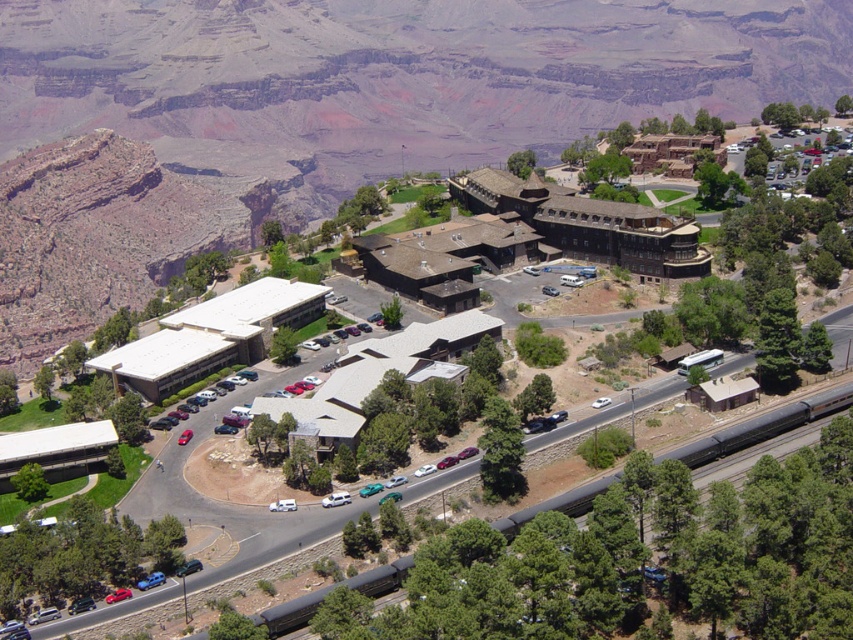
Is brown stone building at center taller than white glossy sedan at center-right?

Indeed, brown stone building at center has a greater height compared to white glossy sedan at center-right.

Who is more forward, (367,35) or (602,406)?

Positioned in front is point (602,406).

I want to click on brown stone building at center, so click(x=326, y=115).

From the picture: Which is below, dark gray metallic train track at lower center or white glossy sedan at center-right?

Positioned lower is dark gray metallic train track at lower center.

Does dark gray metallic train track at lower center have a smaller size compared to white glossy sedan at center-right?

No, dark gray metallic train track at lower center is not smaller than white glossy sedan at center-right.

Is point (547, 500) closer to viewer compared to point (598, 403)?

Yes, it is.

Find the location of a particular element. This screenshot has width=853, height=640. dark gray metallic train track at lower center is located at coordinates (761, 426).

Between dark gray metallic train track at lower center and blue matte car at lower left, which one is positioned higher?

dark gray metallic train track at lower center is above.

Does dark gray metallic train track at lower center appear on the left side of blue matte car at lower left?

No, dark gray metallic train track at lower center is not to the left of blue matte car at lower left.

Where is `dark gray metallic train track at lower center`? The height and width of the screenshot is (640, 853). dark gray metallic train track at lower center is located at coordinates (761, 426).

You are a GUI agent. You are given a task and a screenshot of the screen. Output one action in this format:
    pyautogui.click(x=<x>, y=<y>)
    Task: Click on the dark gray metallic train track at lower center
    
    Given the screenshot: What is the action you would take?
    pyautogui.click(x=761, y=426)